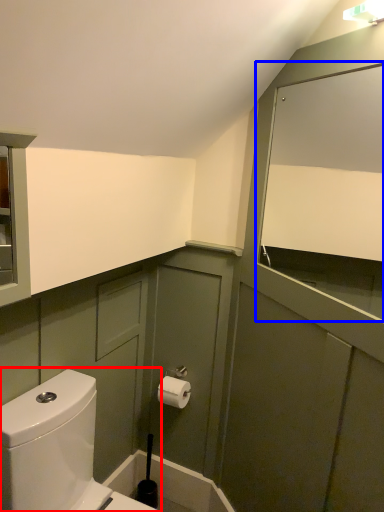
Question: Among these objects, which one is farthest to the camera, toilet (highlighted by a red box) or mirror (highlighted by a blue box)?

Choices:
 (A) toilet
 (B) mirror

Answer: (A)